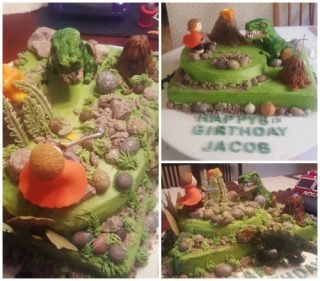
The image size is (320, 281). Identify the location of wood chair back. (299, 20).